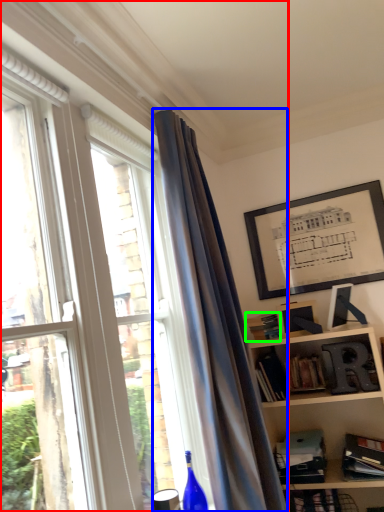
Question: Based on their relative distances, which object is farther from window (highlighted by a red box)? Choose from curtain (highlighted by a blue box) and paperback book (highlighted by a green box).

Choices:
 (A) curtain
 (B) paperback book

Answer: (B)